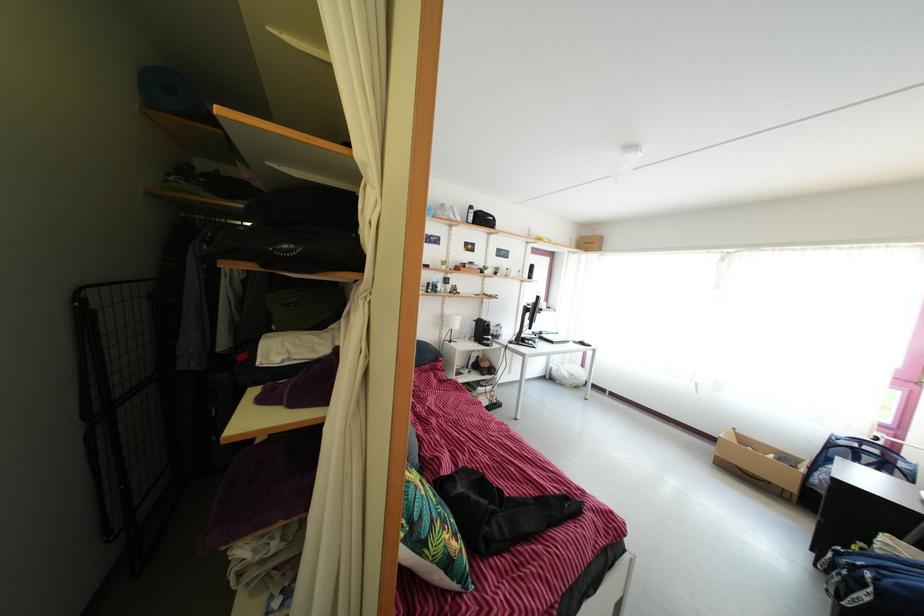
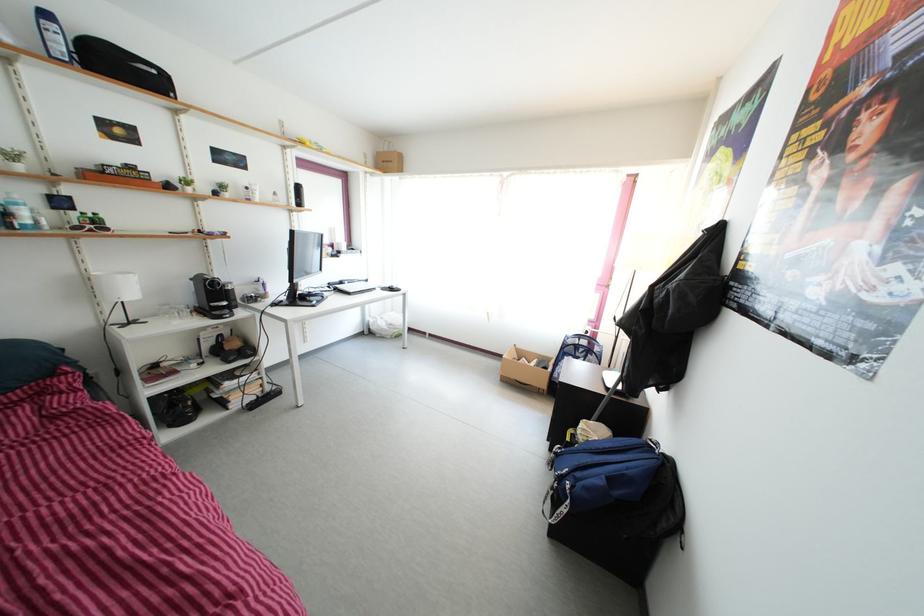
Question: Based on the continuous images, in which direction is the camera rotating? Reply with the corresponding letter.

Choices:
 (A) Left
 (B) Right
 (C) Up
 (D) Down

Answer: (B)